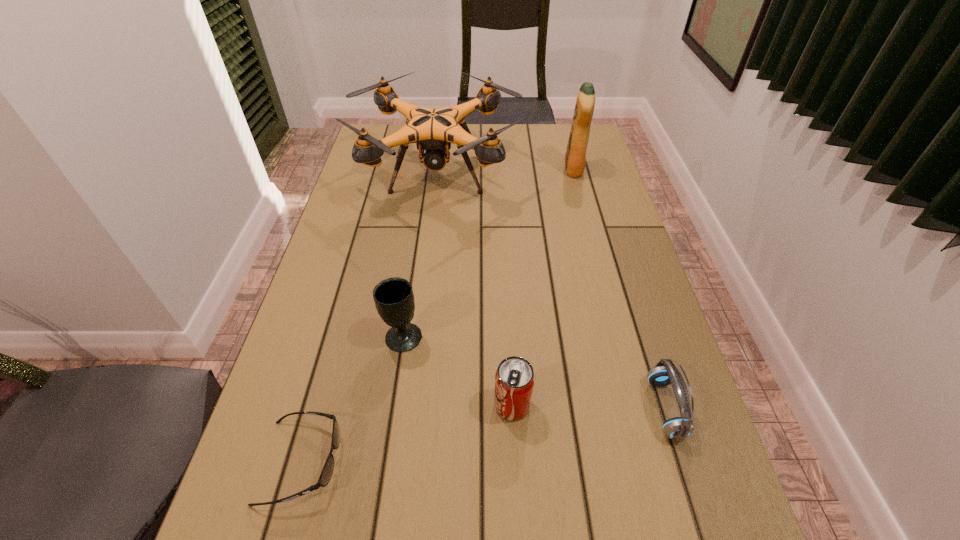
Where is `detergent`? The width and height of the screenshot is (960, 540). detergent is located at coordinates (575, 158).

I want to click on drone, so click(x=433, y=130).

Identify the location of the third tallest object. (394, 300).

Find the location of a particular element. chalice is located at coordinates (394, 300).

Locate an element on the screen. This screenshot has width=960, height=540. pop soda is located at coordinates [x=514, y=380].

Image resolution: width=960 pixels, height=540 pixels. I want to click on headset, so click(x=665, y=373).

Find the location of `sunglasses`. sunglasses is located at coordinates (326, 474).

Where is `free point located on the label of the detergent`? The image size is (960, 540). free point located on the label of the detergent is located at coordinates pyautogui.click(x=528, y=170).

Where is `vacant space located on the label of the detergent`? The height and width of the screenshot is (540, 960). vacant space located on the label of the detergent is located at coordinates (498, 170).

At what (x,y) coordinates should I click in order to perform the action: click on free location located 0.200m on the label of the detergent. Please return your answer as a coordinate pair (x, y). The image size is (960, 540). Looking at the image, I should click on (504, 170).